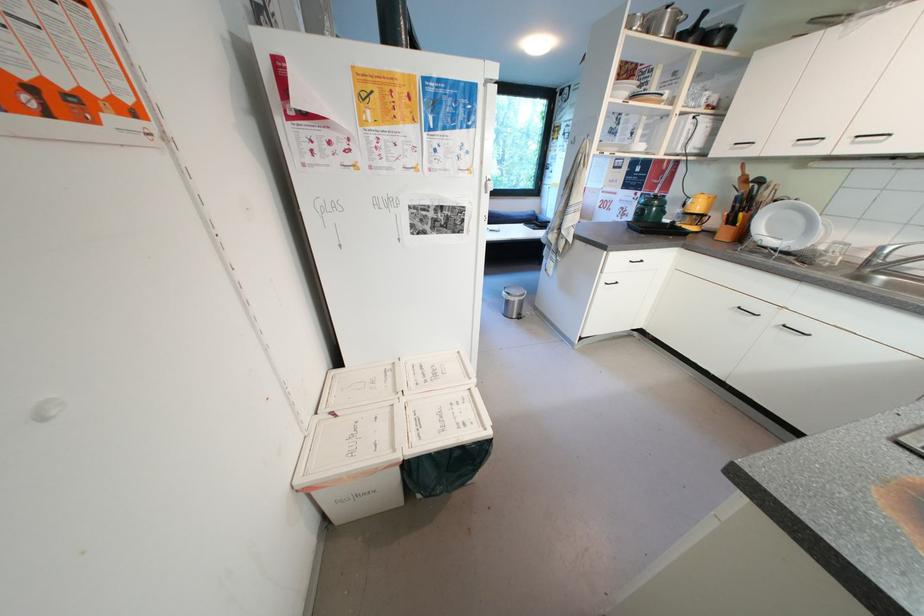
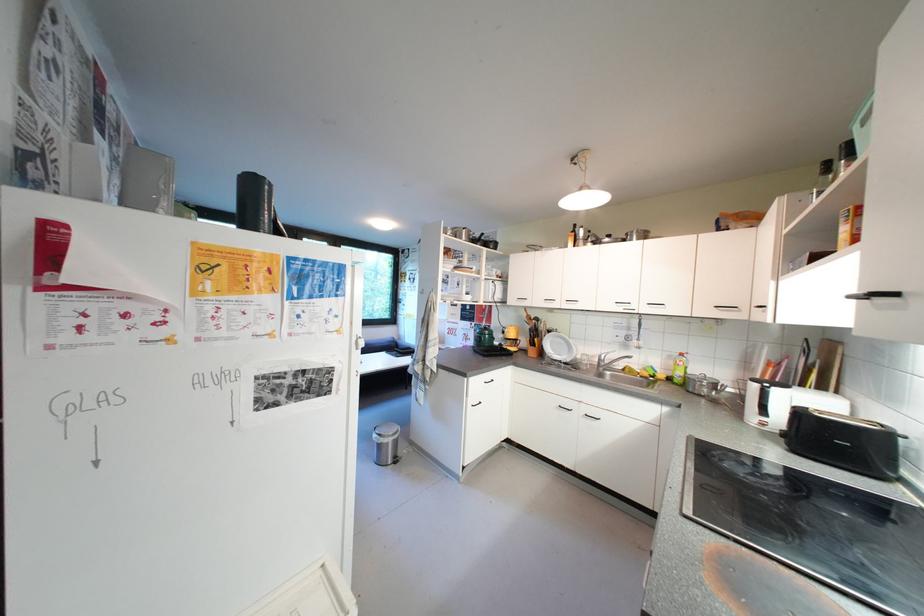
The first image is from the beginning of the video and the second image is from the end. How did the camera likely rotate when shooting the video?

Result: The camera rotated toward right-up.